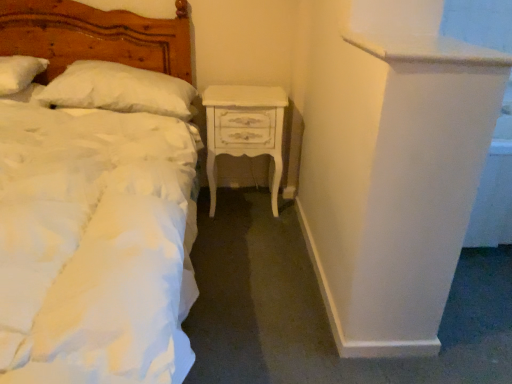
Describe the element at coordinates (244, 129) in the screenshot. This screenshot has height=384, width=512. I see `white painted wood nightstand at center` at that location.

Image resolution: width=512 pixels, height=384 pixels. I want to click on white soft pillow at upper left, the 1th pillow from the left, so click(x=19, y=72).

Can you tell me how much white fluffy pillow at upper left, the second pillow from the left, and white painted wood nightstand at center differ in facing direction?

They differ by 1.89 degrees in their facing directions.

From a real-world perspective, is white fluffy pillow at upper left, which is the 1th pillow in right-to-left order, located higher than white painted wood nightstand at center?

Yes, from a real-world perspective, white fluffy pillow at upper left, which is the 1th pillow in right-to-left order, is over white painted wood nightstand at center

Does white fluffy pillow at upper left, the second pillow from the left, have a greater height compared to white painted wood nightstand at center?

Incorrect, the height of white fluffy pillow at upper left, the second pillow from the left, is not larger of that of white painted wood nightstand at center.

In the image, is white painted wood nightstand at center positioned in front of or behind matte white bed at left?

Visually, white painted wood nightstand at center is located behind matte white bed at left.

Looking at this image, is white painted wood nightstand at center bigger than matte white bed at left?

No.

Which object is thinner, white painted wood nightstand at center or matte white bed at left?

white painted wood nightstand at center.

From a real-world perspective, which object stands above the other?

From a 3D spatial view, matte white bed at left is above.

Which object is thinner, matte white bed at left or white painted wood nightstand at center?

white painted wood nightstand at center.

Would you say matte white bed at left is inside or outside white painted wood nightstand at center?

matte white bed at left is outside white painted wood nightstand at center.

Does point (181, 218) come farther from viewer compared to point (250, 103)?

No, it is not.

Considering the sizes of objects matte white bed at left and white painted wood nightstand at center in the image provided, who is shorter, matte white bed at left or white painted wood nightstand at center?

white painted wood nightstand at center.

Which of these two, white soft pillow at upper left, acting as the second pillow starting from the right, or white painted wood nightstand at center, stands shorter?

Standing shorter between the two is white soft pillow at upper left, acting as the second pillow starting from the right.

From the picture: From a real-world perspective, is white soft pillow at upper left, the 1th pillow from the left, on white painted wood nightstand at center?

Correct, in the physical world, white soft pillow at upper left, the 1th pillow from the left, is higher than white painted wood nightstand at center.

Considering the positions of point (26, 77) and point (263, 120), is point (26, 77) closer or farther from the camera than point (263, 120)?

Point (26, 77).

From the white painted wood nightstand at center, count the 2nd pillow to the left and point to it. Please provide its 2D coordinates.

[(19, 72)]

From the image's perspective, is white painted wood nightstand at center located above or below white fluffy pillow at upper left, which is the 1th pillow in right-to-left order?

white painted wood nightstand at center is below white fluffy pillow at upper left, which is the 1th pillow in right-to-left order.

Who is bigger, white painted wood nightstand at center or white fluffy pillow at upper left, which is the 1th pillow in right-to-left order?

white painted wood nightstand at center.

Is white painted wood nightstand at center touching white fluffy pillow at upper left, which is the 1th pillow in right-to-left order?

→ No, white painted wood nightstand at center is not making contact with white fluffy pillow at upper left, which is the 1th pillow in right-to-left order.

Is white painted wood nightstand at center in front of or behind white fluffy pillow at upper left, which is the 1th pillow in right-to-left order, in the image?

Visually, white painted wood nightstand at center is located behind white fluffy pillow at upper left, which is the 1th pillow in right-to-left order.

Is white soft pillow at upper left, acting as the second pillow starting from the right, facing towards white fluffy pillow at upper left, the second pillow from the left?

No, white soft pillow at upper left, acting as the second pillow starting from the right, is not aimed at white fluffy pillow at upper left, the second pillow from the left.

Is white soft pillow at upper left, the 1th pillow from the left, taller or shorter than white fluffy pillow at upper left, the second pillow from the left?

Considering their sizes, white soft pillow at upper left, the 1th pillow from the left, has less height than white fluffy pillow at upper left, the second pillow from the left.

From a real-world perspective, is white soft pillow at upper left, the 1th pillow from the left, over white fluffy pillow at upper left, which is the 1th pillow in right-to-left order?

Yes, from a real-world perspective, white soft pillow at upper left, the 1th pillow from the left, is on top of white fluffy pillow at upper left, which is the 1th pillow in right-to-left order.

Is white soft pillow at upper left, the 1th pillow from the left, inside or outside of white fluffy pillow at upper left, the second pillow from the left?

white soft pillow at upper left, the 1th pillow from the left, lies outside white fluffy pillow at upper left, the second pillow from the left.

Does point (128, 94) come behind point (37, 63)?

No.

Looking at this image, is white fluffy pillow at upper left, the second pillow from the left, further to camera compared to white soft pillow at upper left, the 1th pillow from the left?

Yes.

Does white fluffy pillow at upper left, the second pillow from the left, turn towards white soft pillow at upper left, acting as the second pillow starting from the right?

No, white fluffy pillow at upper left, the second pillow from the left, is not aimed at white soft pillow at upper left, acting as the second pillow starting from the right.

Which is more to the left, white fluffy pillow at upper left, which is the 1th pillow in right-to-left order, or white soft pillow at upper left, the 1th pillow from the left?

→ Positioned to the left is white soft pillow at upper left, the 1th pillow from the left.

From the image's perspective, which pillow is the 1st one above the white painted wood nightstand at center? Please provide its 2D coordinates.

[(118, 90)]

Find the location of a particular element. bed that appears in front of the white painted wood nightstand at center is located at coordinates (94, 245).

In the scene shown: Estimate the real-world distances between objects in this image. Which object is further from white soft pillow at upper left, acting as the second pillow starting from the right, white painted wood nightstand at center or matte white bed at left?

Based on the image, white painted wood nightstand at center appears to be further to white soft pillow at upper left, acting as the second pillow starting from the right.

From the picture: Which object lies nearer to the anchor point white painted wood nightstand at center, white soft pillow at upper left, the 1th pillow from the left, or matte white bed at left?

matte white bed at left is closer to white painted wood nightstand at center.

Considering their positions, is white fluffy pillow at upper left, which is the 1th pillow in right-to-left order, positioned closer to white painted wood nightstand at center than white soft pillow at upper left, acting as the second pillow starting from the right?

The object closer to white painted wood nightstand at center is white fluffy pillow at upper left, which is the 1th pillow in right-to-left order.

Based on their spatial positions, is white painted wood nightstand at center or white soft pillow at upper left, the 1th pillow from the left, closer to white fluffy pillow at upper left, the second pillow from the left?

white soft pillow at upper left, the 1th pillow from the left.

Considering their positions, is matte white bed at left positioned closer to white painted wood nightstand at center than white fluffy pillow at upper left, which is the 1th pillow in right-to-left order?

white fluffy pillow at upper left, which is the 1th pillow in right-to-left order.

Which object lies nearer to the anchor point matte white bed at left, white painted wood nightstand at center or white soft pillow at upper left, acting as the second pillow starting from the right?

white painted wood nightstand at center.

When comparing their distances from matte white bed at left, does white fluffy pillow at upper left, which is the 1th pillow in right-to-left order, or white soft pillow at upper left, the 1th pillow from the left, seem further?

Among the two, white soft pillow at upper left, the 1th pillow from the left, is located further to matte white bed at left.

Which object lies nearer to the anchor point white fluffy pillow at upper left, the second pillow from the left, white soft pillow at upper left, the 1th pillow from the left, or matte white bed at left?

white soft pillow at upper left, the 1th pillow from the left, lies closer to white fluffy pillow at upper left, the second pillow from the left, than the other object.

Locate an element on the screen. The height and width of the screenshot is (384, 512). pillow positioned between matte white bed at left and white fluffy pillow at upper left, the second pillow from the left, from near to far is located at coordinates (19, 72).

Where is `pillow located between white soft pillow at upper left, the 1th pillow from the left, and white painted wood nightstand at center in the left-right direction`? pillow located between white soft pillow at upper left, the 1th pillow from the left, and white painted wood nightstand at center in the left-right direction is located at coordinates (118, 90).